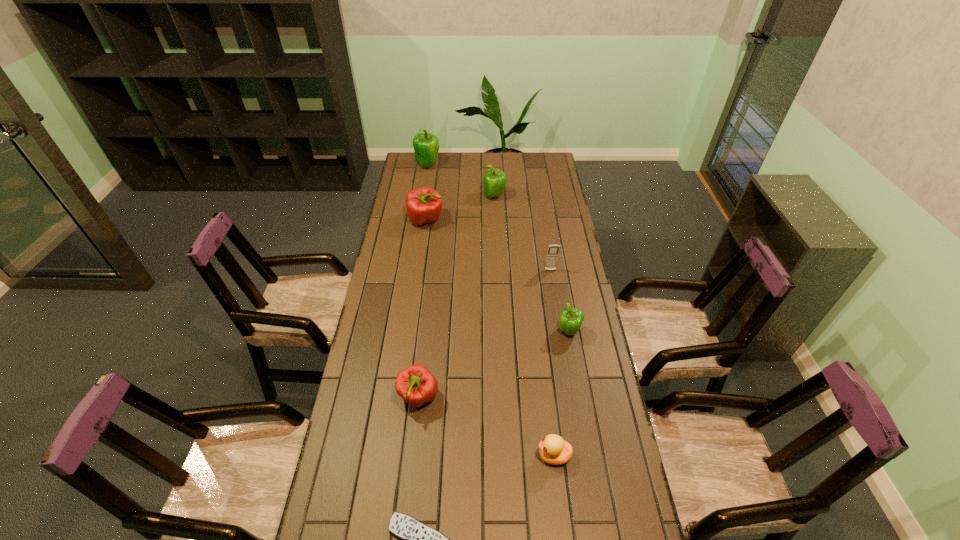
The width and height of the screenshot is (960, 540). I want to click on the nearer pink bell pepper, so click(x=416, y=384).

Find the location of `the smaller pink bell pepper`. the smaller pink bell pepper is located at coordinates (416, 384).

Where is `yellow duckling`? This screenshot has height=540, width=960. yellow duckling is located at coordinates (553, 450).

This screenshot has height=540, width=960. I want to click on the third object from right to left, so click(553, 450).

At what (x,y) coordinates should I click in order to perform the action: click on vacant space located 0.080m on the right of the leftmost green bell pepper. Please return your answer as a coordinate pair (x, y). Looking at the image, I should click on (455, 165).

Where is `vacant area situated 0.090m on the right of the second farthest object`? The height and width of the screenshot is (540, 960). vacant area situated 0.090m on the right of the second farthest object is located at coordinates (524, 196).

Locate an element on the screen. The width and height of the screenshot is (960, 540). vacant space located on the back of the farther pink bell pepper is located at coordinates (433, 169).

I want to click on free region located on the front-facing side of the gray cellular telephone, so click(557, 310).

Identify the location of blank area located 0.370m on the front of the second nearest bell pepper. (589, 446).

The height and width of the screenshot is (540, 960). Find the location of `free space located 0.080m on the back of the nearer pink bell pepper`. free space located 0.080m on the back of the nearer pink bell pepper is located at coordinates [423, 358].